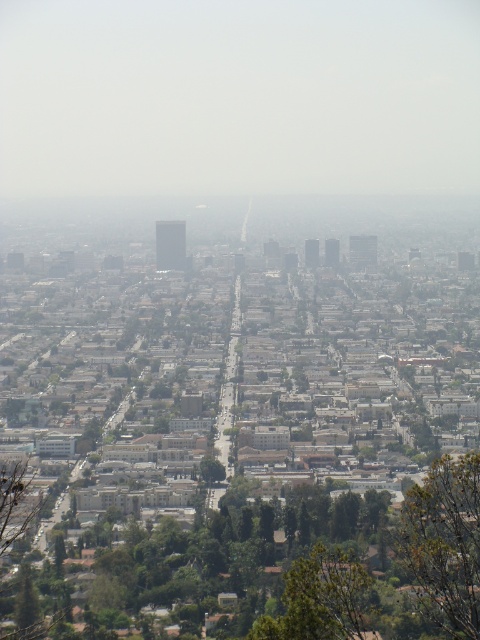
Question: Among these objects, which one is nearest to the camera?

Choices:
 (A) green leafy tree at lower right
 (B) green leafy tree at lower center

Answer: (A)

Question: Which of the following is the farthest from the observer?

Choices:
 (A) green leafy tree at lower center
 (B) green leafy tree at lower right

Answer: (A)

Question: Is the position of green leafy tree at lower right more distant than that of green leafy tree at lower center?

Choices:
 (A) no
 (B) yes

Answer: (A)

Question: Is the position of green leafy tree at lower right more distant than that of green leafy tree at lower center?

Choices:
 (A) yes
 (B) no

Answer: (B)

Question: Is green leafy tree at lower right to the right of green leafy tree at lower center from the viewer's perspective?

Choices:
 (A) no
 (B) yes

Answer: (B)